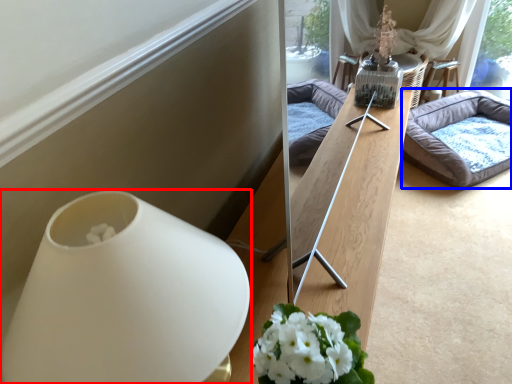
Question: Which object is closer to the camera taking this photo, vase (highlighted by a red box) or studio couch (highlighted by a blue box)?

Choices:
 (A) vase
 (B) studio couch

Answer: (A)